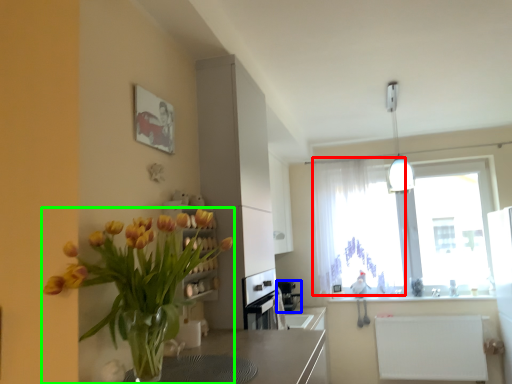
Question: Which object is the farthest from curtain (highlighted by a red box)? Choose among these: appliance (highlighted by a blue box) or houseplant (highlighted by a green box).

Choices:
 (A) appliance
 (B) houseplant

Answer: (B)